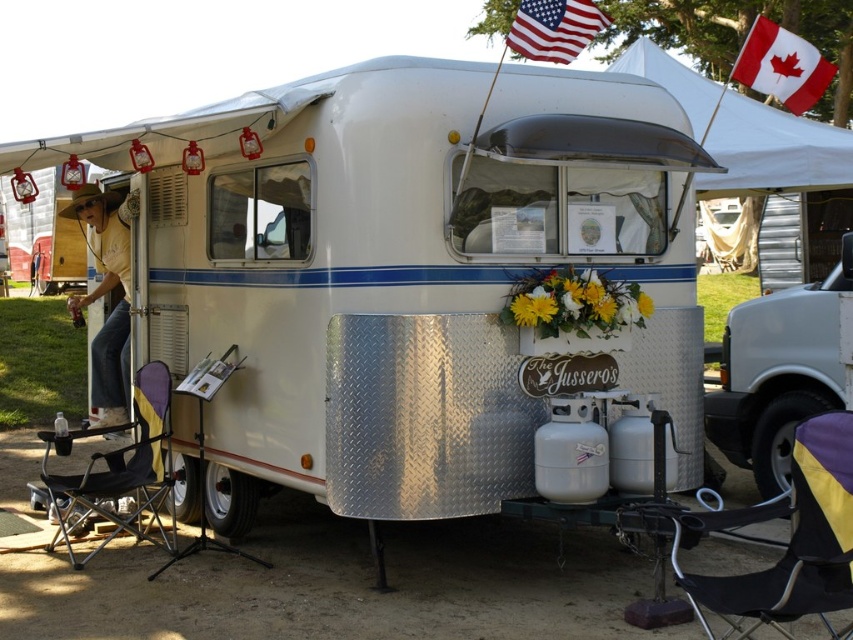
You are standing in front of the vintage travel trailer. There is a point marked at coordinates (776, 372). What object does this point indicate?

The point at coordinates (776, 372) marks the white metallic camper at right.

You are standing at the origin point of the coordinate system where the trailer park is mapped. You want to locate the white metallic camper at right. What are its coordinates?

The white metallic camper at right is located at coordinates point (776,372).

You are a photographer trying to capture both the white aluminum trailer at center and the red fabric flag at upper right in a single shot. Based on their widths, which object should you position closer to the camera to ensure both fit in the frame?

Since the white aluminum trailer at center is thinner than the red fabric flag at upper right, you should position the white aluminum trailer at center closer to the camera to ensure both fit in the frame.